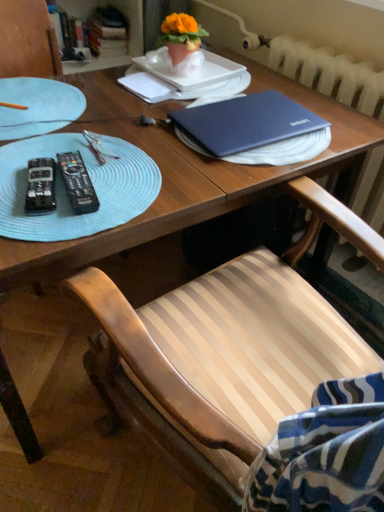
Find the location of `vacant area that is in front of orange matte flower pot at upper center`. vacant area that is in front of orange matte flower pot at upper center is located at coordinates (183, 79).